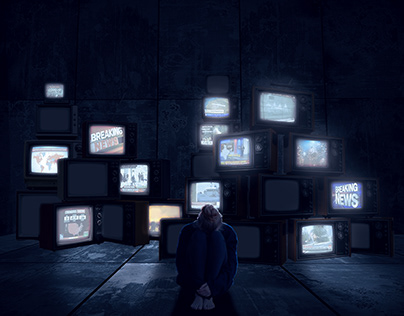
At what (x,y) coordinates should I click in order to perform the action: click on tv screens turned off. Please return your answer as a coordinate pair (x, y). The image size is (404, 316). Looking at the image, I should click on (51, 121), (30, 208), (111, 219), (91, 185), (172, 232), (243, 234), (204, 165), (220, 84), (279, 197), (362, 233).